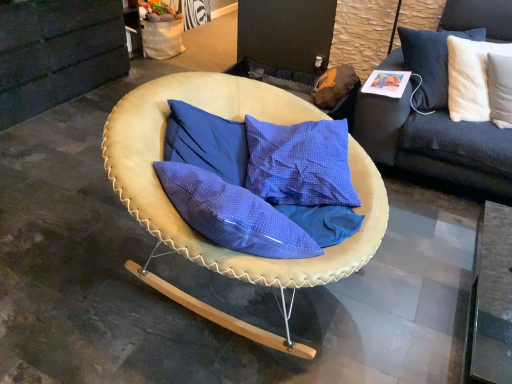
Find the location of a particular element. The image size is (512, 384). dark gray fabric couch at upper right is located at coordinates (434, 144).

From the image's perspective, does dark gray fabric couch at upper right appear lower than leather-like beige chair at center?

Incorrect, from the image's perspective, dark gray fabric couch at upper right is higher than leather-like beige chair at center.

Which is behind, dark gray fabric couch at upper right or leather-like beige chair at center?

dark gray fabric couch at upper right is behind.

Is dark gray fabric couch at upper right shorter than leather-like beige chair at center?

In fact, dark gray fabric couch at upper right may be taller than leather-like beige chair at center.

From the picture: From a real-world perspective, is dark gray fabric couch at upper right located beneath leather-like beige chair at center?

No, from a real-world perspective, dark gray fabric couch at upper right is not below leather-like beige chair at center.

Is dark gray fabric couch at upper right not within white soft cushion at upper right?

dark gray fabric couch at upper right lies outside white soft cushion at upper right's area.

Is dark gray fabric couch at upper right wider than white soft cushion at upper right?

Indeed, dark gray fabric couch at upper right has a greater width compared to white soft cushion at upper right.

Is dark gray fabric couch at upper right positioned with its back to white soft cushion at upper right?

No, dark gray fabric couch at upper right is not facing away from white soft cushion at upper right.

Which is in front, dark gray fabric couch at upper right or white soft cushion at upper right?

white soft cushion at upper right is closer to the camera.

Based on the photo, in the image, is leather-like beige chair at center on the left side or the right side of white soft cushion at upper right?

leather-like beige chair at center is positioned on white soft cushion at upper right's left side.

Image resolution: width=512 pixels, height=384 pixels. Identify the location of chair below the white soft cushion at upper right (from the image's perspective). (234, 120).

From a real-world perspective, which object rests below the other?

leather-like beige chair at center.

Would you say leather-like beige chair at center is outside white soft cushion at upper right?

leather-like beige chair at center lies outside white soft cushion at upper right's area.

Considering the relative sizes of leather-like beige chair at center and dark gray fabric couch at upper right in the image provided, is leather-like beige chair at center taller than dark gray fabric couch at upper right?

In fact, leather-like beige chair at center may be shorter than dark gray fabric couch at upper right.

Is leather-like beige chair at center not near dark gray fabric couch at upper right?

leather-like beige chair at center is actually quite close to dark gray fabric couch at upper right.

At what (x,y) coordinates should I click in order to perform the action: click on studio couch that is above the leather-like beige chair at center (from the image's perspective). Please return your answer as a coordinate pair (x, y). Looking at the image, I should click on (434, 144).

Considering the points (298, 283) and (494, 37), which point is in front, point (298, 283) or point (494, 37)?

The point (298, 283) is closer to the camera.

How different are the orientations of white soft cushion at upper right and dark gray fabric couch at upper right in degrees?

white soft cushion at upper right and dark gray fabric couch at upper right are facing 6.47 degrees away from each other.

From a real-world perspective, does white soft cushion at upper right sit lower than dark gray fabric couch at upper right?

Correct, in the physical world, white soft cushion at upper right is lower than dark gray fabric couch at upper right.

Considering their positions, is white soft cushion at upper right located in front of or behind dark gray fabric couch at upper right?

Clearly, white soft cushion at upper right is in front of dark gray fabric couch at upper right.

From the image's perspective, would you say white soft cushion at upper right is shown under dark gray fabric couch at upper right?

Yes.

Where is `pillow lying behind the leather-like beige chair at center`? The image size is (512, 384). pillow lying behind the leather-like beige chair at center is located at coordinates (470, 77).

Which object is closer to the camera, white soft cushion at upper right or leather-like beige chair at center?

leather-like beige chair at center is more forward.

Is leather-like beige chair at center inside white soft cushion at upper right?

That's incorrect, leather-like beige chair at center is not inside white soft cushion at upper right.

I want to click on chair in front of the dark gray fabric couch at upper right, so tap(234, 120).

The height and width of the screenshot is (384, 512). Identify the location of pillow below the dark gray fabric couch at upper right (from a real-world perspective). (470, 77).

Looking at the image, which one is located further to dark gray fabric couch at upper right, white soft cushion at upper right or leather-like beige chair at center?

leather-like beige chair at center is positioned further to the anchor dark gray fabric couch at upper right.

Which object lies further to the anchor point dark gray fabric couch at upper right, leather-like beige chair at center or white soft cushion at upper right?

leather-like beige chair at center is further to dark gray fabric couch at upper right.

When comparing their distances from white soft cushion at upper right, does dark gray fabric couch at upper right or leather-like beige chair at center seem further?

leather-like beige chair at center is positioned further to the anchor white soft cushion at upper right.

From the image, which object appears to be farther from leather-like beige chair at center, white soft cushion at upper right or dark gray fabric couch at upper right?

white soft cushion at upper right is further to leather-like beige chair at center.

When comparing their distances from leather-like beige chair at center, does dark gray fabric couch at upper right or white soft cushion at upper right seem further?

white soft cushion at upper right is positioned further to the anchor leather-like beige chair at center.

Looking at the image, which one is located closer to white soft cushion at upper right, leather-like beige chair at center or dark gray fabric couch at upper right?

dark gray fabric couch at upper right.

The width and height of the screenshot is (512, 384). What are the coordinates of `studio couch situated between leather-like beige chair at center and white soft cushion at upper right from left to right` in the screenshot? It's located at (434, 144).